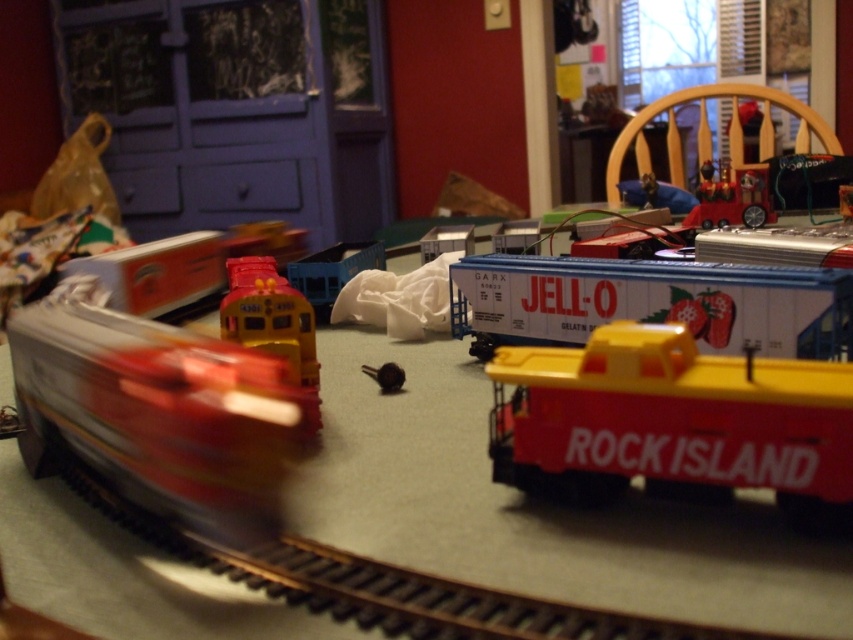
Does yellow plastic train car at center-right have a smaller size compared to yellow plastic train at center?

Correct, yellow plastic train car at center-right occupies less space than yellow plastic train at center.

Does point (582, 385) lie in front of point (225, 330)?

Yes, it is.

This screenshot has height=640, width=853. Describe the element at coordinates (672, 420) in the screenshot. I see `yellow plastic train car at center-right` at that location.

In order to click on yellow plastic train car at center-right in this screenshot , I will do `click(672, 420)`.

Which is in front, point (763, 172) or point (395, 387)?

Point (395, 387)

Is point (721, 220) closer to viewer compared to point (397, 372)?

That is False.

You are a GUI agent. You are given a task and a screenshot of the screen. Output one action in this format:
    pyautogui.click(x=<x>, y=<y>)
    Task: Click on the metallic red train at upper right
    The width and height of the screenshot is (853, 640).
    Given the screenshot: What is the action you would take?
    pyautogui.click(x=732, y=198)

Who is shorter, yellow plastic train car at center-right or white plastic train car at center?

white plastic train car at center

Is yellow plastic train car at center-right further to camera compared to white plastic train car at center?

No, it is in front of white plastic train car at center.

Which is behind, point (689, 460) or point (495, 253)?

Point (495, 253)

At what (x,y) coordinates should I click in order to perform the action: click on yellow plastic train car at center-right. Please return your answer as a coordinate pair (x, y). Looking at the image, I should click on (672, 420).